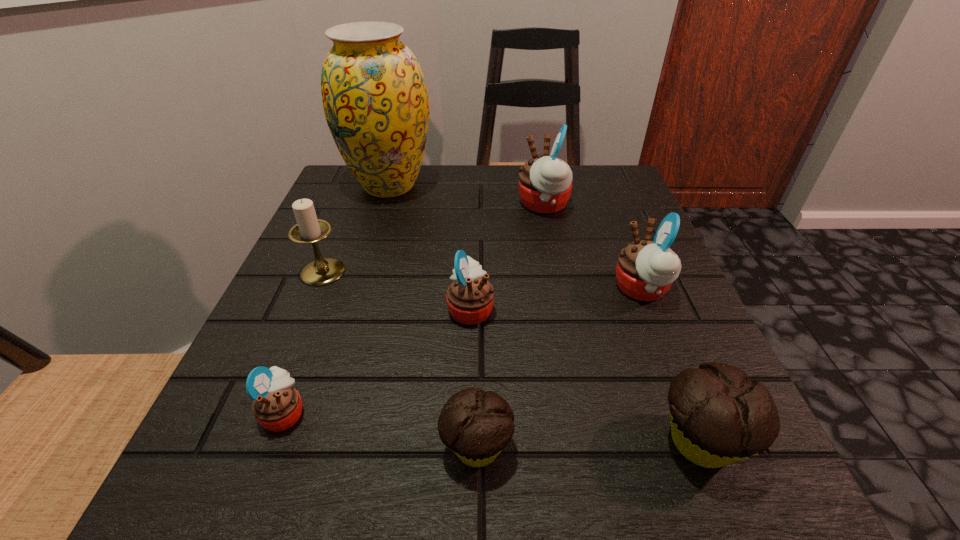
Locate an element on the screen. The width and height of the screenshot is (960, 540). yellow vase is located at coordinates (375, 99).

This screenshot has width=960, height=540. I want to click on vase, so click(x=375, y=99).

Identify the location of the farthest pink muffin. (545, 183).

Where is `the farthest muffin`? This screenshot has height=540, width=960. the farthest muffin is located at coordinates (545, 183).

This screenshot has width=960, height=540. Find the location of `candle holder`. candle holder is located at coordinates (309, 229).

The height and width of the screenshot is (540, 960). What are the coordinates of `the rightmost pink muffin` in the screenshot? It's located at (645, 270).

The width and height of the screenshot is (960, 540). Find the location of `the second tallest muffin`. the second tallest muffin is located at coordinates (645, 270).

Where is `the second pink muffin from left to right`? the second pink muffin from left to right is located at coordinates (470, 297).

Find the location of a particular element. The width and height of the screenshot is (960, 540). the bigger chocolate muffin is located at coordinates (718, 416).

Locate an element on the screen. This screenshot has height=540, width=960. the nearest pink muffin is located at coordinates (277, 406).